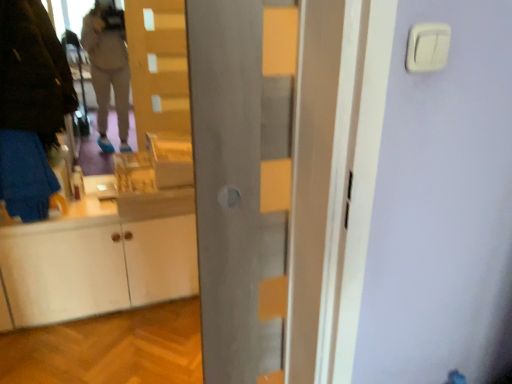
Question: Is white plastic light switch at upper right not close to metallic gray door at center?

Choices:
 (A) no
 (B) yes

Answer: (A)

Question: Is white plastic light switch at upper right positioned in front of metallic gray door at center?

Choices:
 (A) no
 (B) yes

Answer: (B)

Question: Considering the relative positions of white plastic light switch at upper right and metallic gray door at center in the image provided, is white plastic light switch at upper right to the left of metallic gray door at center from the viewer's perspective?

Choices:
 (A) no
 (B) yes

Answer: (A)

Question: Considering the relative sizes of white plastic light switch at upper right and metallic gray door at center in the image provided, is white plastic light switch at upper right thinner than metallic gray door at center?

Choices:
 (A) yes
 (B) no

Answer: (A)

Question: Can you confirm if white plastic light switch at upper right is positioned to the right of metallic gray door at center?

Choices:
 (A) yes
 (B) no

Answer: (A)

Question: From the image's perspective, is white plastic light switch at upper right above metallic gray door at center?

Choices:
 (A) no
 (B) yes

Answer: (B)

Question: From a real-world perspective, is dark brown leather jacket at left on top of metallic gray door at center?

Choices:
 (A) no
 (B) yes

Answer: (B)

Question: Can you confirm if dark brown leather jacket at left is smaller than metallic gray door at center?

Choices:
 (A) yes
 (B) no

Answer: (B)

Question: From the image's perspective, is dark brown leather jacket at left above metallic gray door at center?

Choices:
 (A) no
 (B) yes

Answer: (B)

Question: Is dark brown leather jacket at left positioned before metallic gray door at center?

Choices:
 (A) yes
 (B) no

Answer: (B)

Question: Does dark brown leather jacket at left have a greater width compared to metallic gray door at center?

Choices:
 (A) no
 (B) yes

Answer: (B)

Question: Is dark brown leather jacket at left facing away from metallic gray door at center?

Choices:
 (A) yes
 (B) no

Answer: (B)

Question: Considering the relative sizes of metallic gray door at center and white plastic light switch at upper right in the image provided, is metallic gray door at center smaller than white plastic light switch at upper right?

Choices:
 (A) no
 (B) yes

Answer: (A)